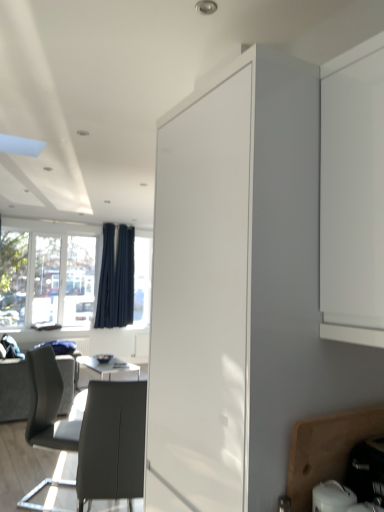
Question: Is dark blue fabric curtain at left, which is the second curtain in right-to-left order, thinner than wooden cutting board at lower right, placed as the second cabinetry when sorted from top to bottom?

Choices:
 (A) yes
 (B) no

Answer: (A)

Question: Considering the relative sizes of dark blue fabric curtain at left, which is the second curtain in right-to-left order, and wooden cutting board at lower right, placed as the second cabinetry when sorted from top to bottom, in the image provided, is dark blue fabric curtain at left, which is the second curtain in right-to-left order, shorter than wooden cutting board at lower right, placed as the second cabinetry when sorted from top to bottom,?

Choices:
 (A) no
 (B) yes

Answer: (A)

Question: Does dark blue fabric curtain at left, arranged as the first curtain when viewed from the left, have a larger size compared to wooden cutting board at lower right, placed as the second cabinetry when sorted from top to bottom?

Choices:
 (A) no
 (B) yes

Answer: (B)

Question: Is dark blue fabric curtain at left, arranged as the first curtain when viewed from the left, to the right of wooden cutting board at lower right, which is the first cabinetry from bottom to top, from the viewer's perspective?

Choices:
 (A) yes
 (B) no

Answer: (B)

Question: Does dark blue fabric curtain at left, which is the second curtain in right-to-left order, have a greater height compared to wooden cutting board at lower right, placed as the second cabinetry when sorted from top to bottom?

Choices:
 (A) yes
 (B) no

Answer: (A)

Question: Is transparent glass window at left situated inside wooden cutting board at lower right, placed as the second cabinetry when sorted from top to bottom, or outside?

Choices:
 (A) inside
 (B) outside

Answer: (B)

Question: Looking at their shapes, would you say transparent glass window at left is wider or thinner than wooden cutting board at lower right, placed as the second cabinetry when sorted from top to bottom?

Choices:
 (A) thin
 (B) wide

Answer: (A)

Question: In terms of size, does transparent glass window at left appear bigger or smaller than wooden cutting board at lower right, which is the first cabinetry from bottom to top?

Choices:
 (A) small
 (B) big

Answer: (B)

Question: From the image's perspective, is transparent glass window at left above or below wooden cutting board at lower right, which is the first cabinetry from bottom to top?

Choices:
 (A) below
 (B) above

Answer: (B)

Question: From a real-world perspective, relative to dark blue fabric curtain at left, arranged as the 2th curtain when viewed from the left, is dark gray fabric couch at lower left vertically above or below?

Choices:
 (A) below
 (B) above

Answer: (A)

Question: Considering the positions of dark gray fabric couch at lower left and dark blue fabric curtain at left, which ranks as the 1th curtain in right-to-left order, in the image, is dark gray fabric couch at lower left taller or shorter than dark blue fabric curtain at left, which ranks as the 1th curtain in right-to-left order,?

Choices:
 (A) tall
 (B) short

Answer: (B)

Question: Considering the positions of point (18, 416) and point (119, 281), is point (18, 416) closer or farther from the camera than point (119, 281)?

Choices:
 (A) closer
 (B) farther

Answer: (A)

Question: Is dark gray fabric couch at lower left inside or outside of dark blue fabric curtain at left, arranged as the 2th curtain when viewed from the left?

Choices:
 (A) outside
 (B) inside

Answer: (A)

Question: Is point (377, 417) positioned closer to the camera than point (104, 224)?

Choices:
 (A) closer
 (B) farther

Answer: (A)

Question: In terms of width, does wooden cutting board at lower right, which is the first cabinetry from bottom to top, look wider or thinner when compared to dark blue fabric curtain at left, arranged as the first curtain when viewed from the left?

Choices:
 (A) thin
 (B) wide

Answer: (B)